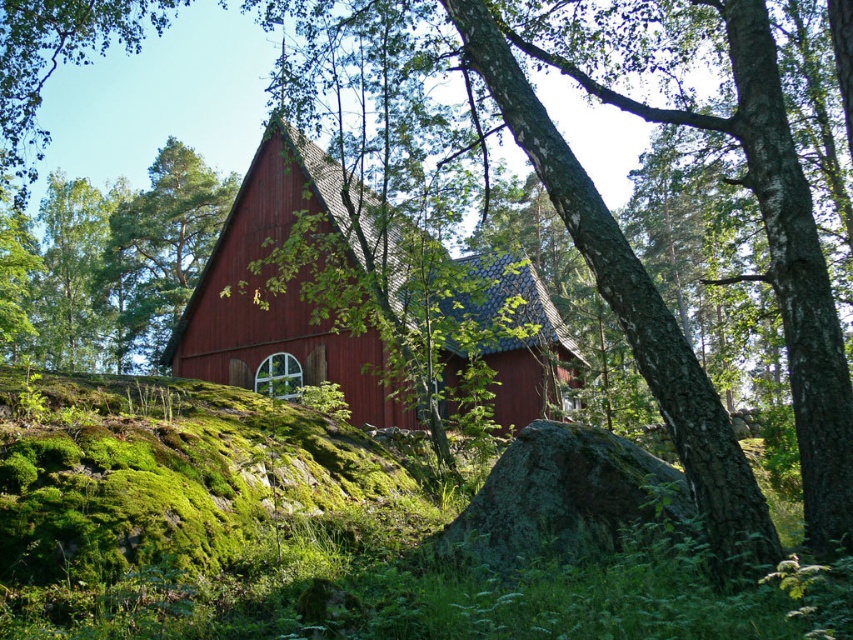
You are planning to build a small garden between the matte wooden barn at center and the smooth bark tree at center. Which object should you place the garden closer to if you want the garden to be near the larger structure?

The smooth bark tree at center is larger than the matte wooden barn at center, so you should place the garden closer to the smooth bark tree at center.

You are standing at the point with coordinates point (364, 305) in the image of the rustic wooden house. What object is located exactly at that point?

The point (364, 305) is where the matte wooden barn at center is located.

Consider the image. You are standing in front of the rustic wooden house and see the matte wooden barn at center and the smooth bark tree at center. Which object is closer to you?

The matte wooden barn at center is closer to you because it is in front of the smooth bark tree at center.